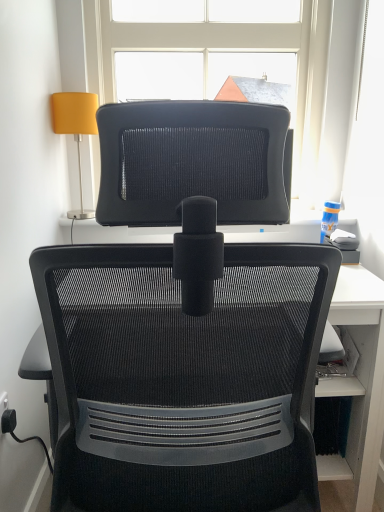
Question: Is black mesh chair at center taller or shorter than black plastic plug at lower left?

Choices:
 (A) short
 (B) tall

Answer: (B)

Question: From the image's perspective, relative to black plastic plug at lower left, is black mesh chair at center above or below?

Choices:
 (A) below
 (B) above

Answer: (B)

Question: Which is nearer to the black mesh chair at center?

Choices:
 (A) black plastic plug at lower left
 (B) transparent glass window at upper center
 (C) matte yellow fabric lampshade at upper left

Answer: (A)

Question: Based on their relative distances, which object is nearer to the transparent glass window at upper center?

Choices:
 (A) black plastic plug at lower left
 (B) black mesh chair at center
 (C) matte yellow fabric lampshade at upper left

Answer: (C)